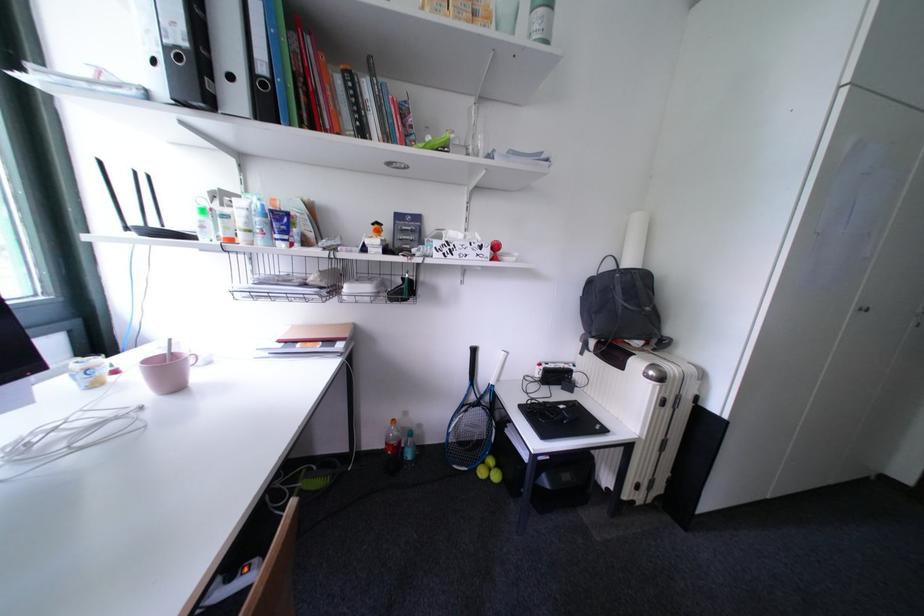
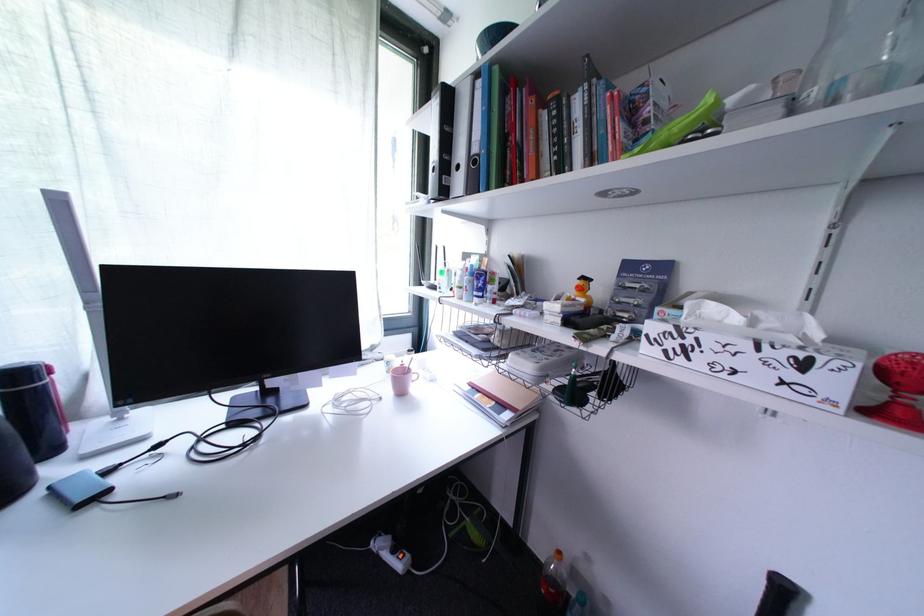
Locate, in the second image, the point that corresponds to the point at 381,227 in the first image.

(588, 282)